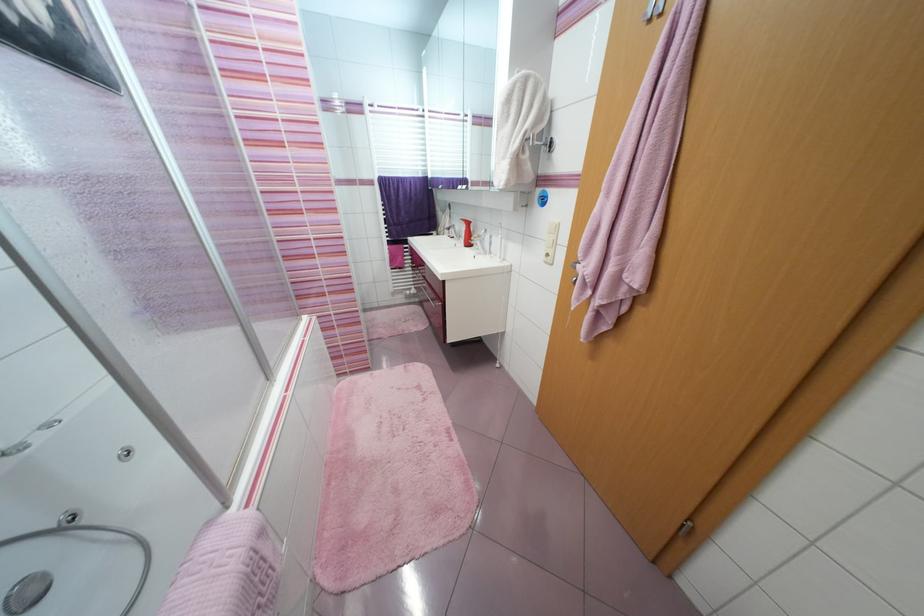
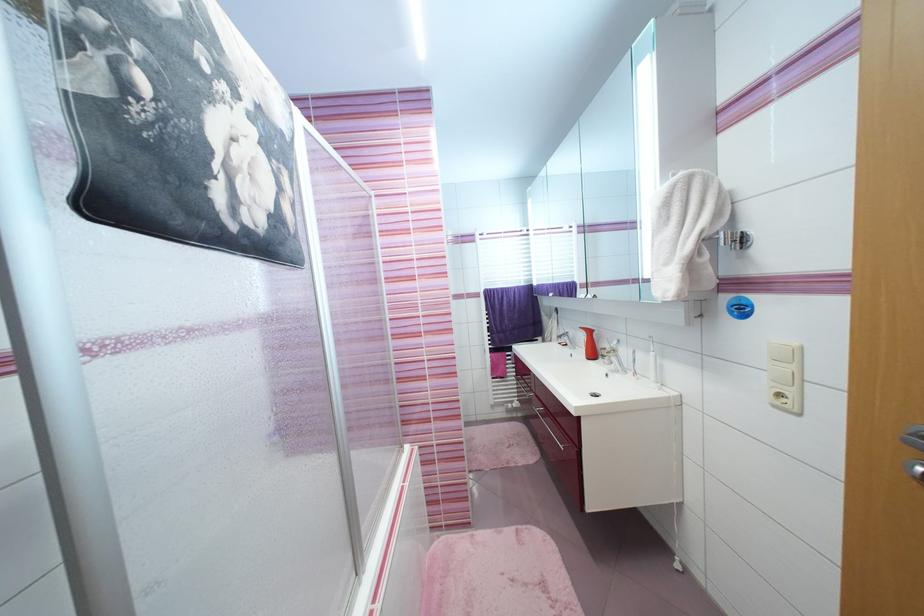
The images are taken continuously from a first-person perspective. In which direction are you moving?

The cameraman moved toward left, forward.